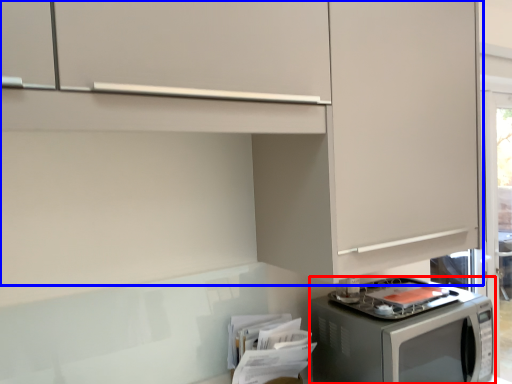
Question: Which of the following is the closest to the observer, home appliance (highlighted by a red box) or cabinetry (highlighted by a blue box)?

Choices:
 (A) home appliance
 (B) cabinetry

Answer: (B)